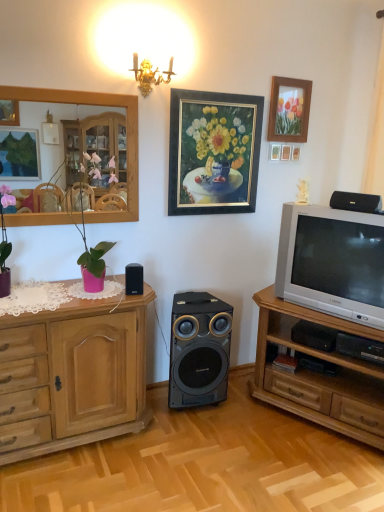
Locate an element on the screen. free space in front of black plastic speaker at center, arranged as the third loudspeaker when viewed from the right is located at coordinates tap(127, 296).